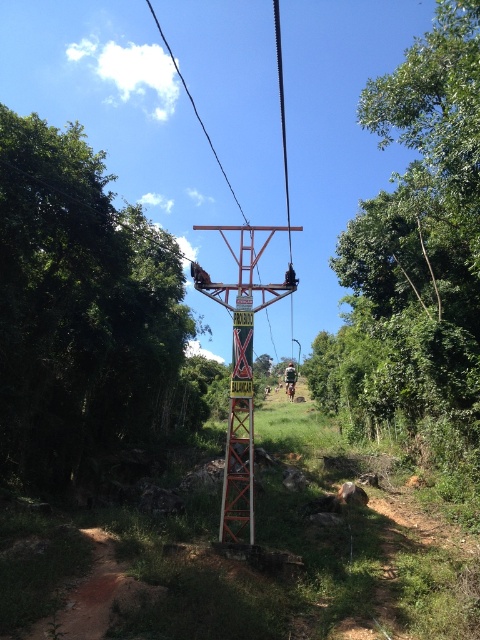
Consider the image. Does metallic wire at center appear under brown leather backpack at center?

Incorrect, metallic wire at center is not positioned below brown leather backpack at center.

Does metallic wire at center appear over brown leather backpack at center?

Correct, metallic wire at center is located above brown leather backpack at center.

Identify the location of metallic wire at center. (284, 154).

Can you confirm if green leafy tree at center is bigger than brown leather backpack at center?

Correct, green leafy tree at center is larger in size than brown leather backpack at center.

Can you confirm if green leafy tree at center is positioned to the right of brown leather backpack at center?

Correct, you'll find green leafy tree at center to the right of brown leather backpack at center.

I want to click on green leafy tree at center, so click(415, 253).

Is green leafy tree at center in front of metallic wire at center?

Yes, it is in front of metallic wire at center.

Between green leafy tree at center and metallic wire at center, which one appears on the left side from the viewer's perspective?

metallic wire at center

Which is behind, point (336, 372) or point (276, 29)?

Point (276, 29)

The image size is (480, 640). I want to click on green leafy tree at center, so click(415, 253).